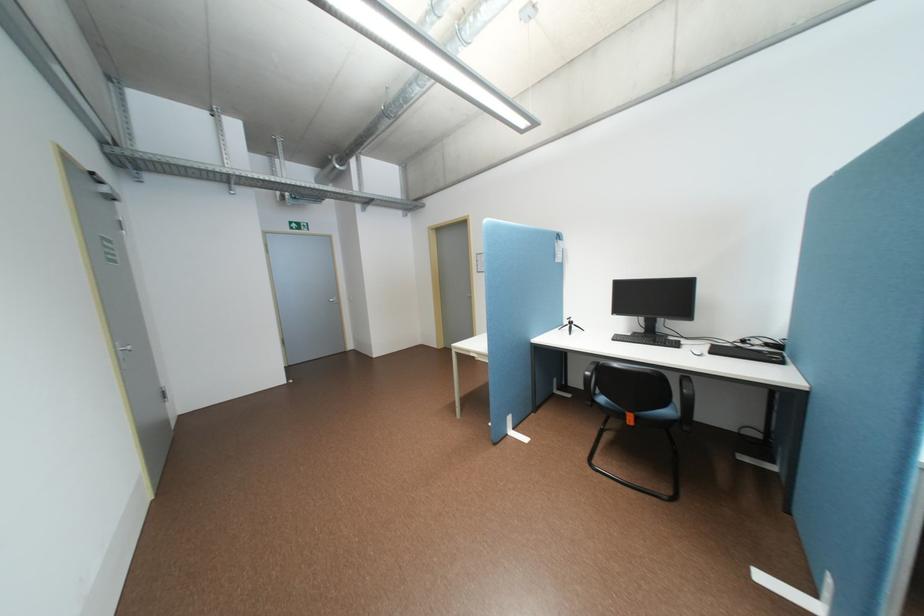
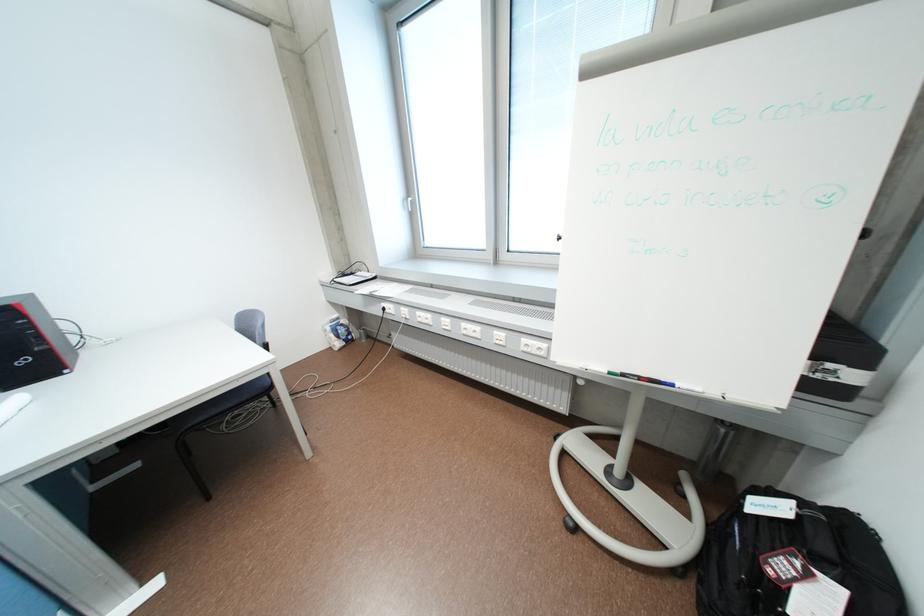
How did the camera likely rotate?

The rotation direction of the camera is right-down.